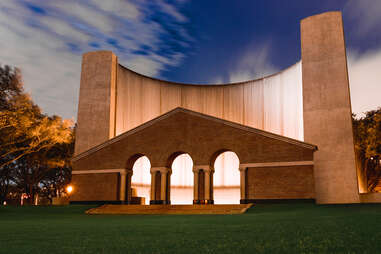
You are a GUI agent. You are given a task and a screenshot of the screen. Output one action in this format:
    pyautogui.click(x=<x>, y=<y>)
    Task: Click on the wall
    
    Given the screenshot: What is the action you would take?
    pyautogui.click(x=17, y=202), pyautogui.click(x=38, y=203)